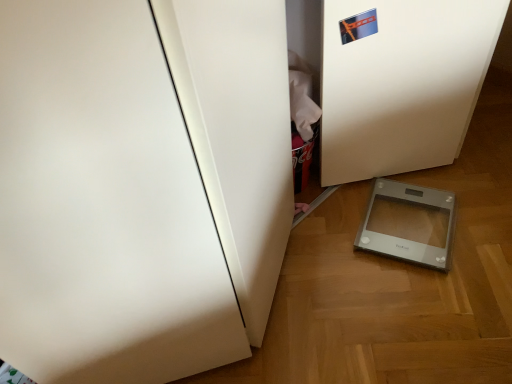
Find the location of `free spot to the right of transparent plastic scale at lower right`. free spot to the right of transparent plastic scale at lower right is located at coordinates (x=476, y=206).